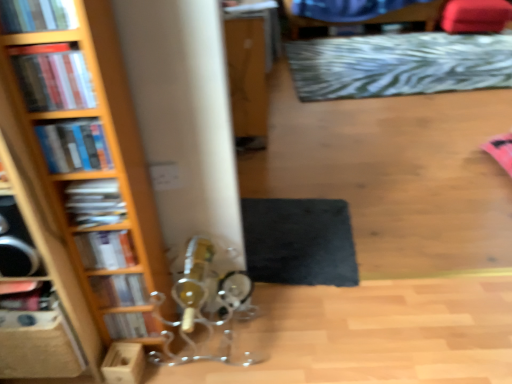
What is the approximate width of matte black book at left, arranged as the 4th book when viewed from the front?

2.40 inches.

Describe the element at coordinates (74, 145) in the screenshot. Image resolution: width=512 pixels, height=384 pixels. I see `hardcover books at left, positioned as the 3th book in top-to-bottom order` at that location.

Measure the distance between wooden bookcase at left and camera.

33.07 inches.

This screenshot has width=512, height=384. Find the location of `matte black book at left, placed as the fourth book when sorted from bottom to top`. matte black book at left, placed as the fourth book when sorted from bottom to top is located at coordinates (94, 203).

From a real-world perspective, is black matte speaker at left over wooden bookcase at left?

Yes, from a real-world perspective, black matte speaker at left is above wooden bookcase at left.

Does point (11, 236) appear closer or farther from the camera than point (112, 213)?

Clearly, point (11, 236) is closer to the camera than point (112, 213).

Considering the sizes of objects black matte speaker at left and wooden bookcase at left in the image provided, who is thinner, black matte speaker at left or wooden bookcase at left?

Thinner between the two is black matte speaker at left.

Considering the sizes of objects blue fabric swivel chair at upper center and hardcover book at upper left, marked as the first book in a front-to-back arrangement, in the image provided, who is smaller, blue fabric swivel chair at upper center or hardcover book at upper left, marked as the first book in a front-to-back arrangement,?

Smaller between the two is hardcover book at upper left, marked as the first book in a front-to-back arrangement.

How different are the orientations of blue fabric swivel chair at upper center and hardcover book at upper left, which is counted as the first book, starting from the top, in degrees?

blue fabric swivel chair at upper center and hardcover book at upper left, which is counted as the first book, starting from the top, are facing 1.14 degrees away from each other.

Does blue fabric swivel chair at upper center have a lesser width compared to hardcover book at upper left, marked as the 7th book in a back-to-front arrangement?

No.

Is wooden bookcase at left oriented away from black felt mat at lower center, which is counted as the 2th mat, starting from the right?

No, wooden bookcase at left's orientation is not away from black felt mat at lower center, which is counted as the 2th mat, starting from the right.

Is wooden bookcase at left to the right of black felt mat at lower center, positioned as the second mat in top-to-bottom order, from the viewer's perspective?

In fact, wooden bookcase at left is to the left of black felt mat at lower center, positioned as the second mat in top-to-bottom order.

Is point (75, 91) farther from viewer compared to point (291, 225)?

No.

Can you confirm if wooden bookcase at left is shorter than black felt mat at lower center, positioned as the second mat in top-to-bottom order?

In fact, wooden bookcase at left may be taller than black felt mat at lower center, positioned as the second mat in top-to-bottom order.

From the image's perspective, is hardcover book at upper left, which is counted as the first book, starting from the top, above or below matte plastic books at left, the 2th book from the front?

hardcover book at upper left, which is counted as the first book, starting from the top, is above matte plastic books at left, the 2th book from the front.

Does point (61, 24) come in front of point (19, 47)?

Yes, it is.

How many degrees apart are the facing directions of hardcover book at upper left, marked as the 7th book in a back-to-front arrangement, and matte plastic books at left, the 6th book from the bottom?

The angular difference between hardcover book at upper left, marked as the 7th book in a back-to-front arrangement, and matte plastic books at left, the 6th book from the bottom, is 0.549 degrees.

Is hardcover book at upper left, marked as the 7th book in a back-to-front arrangement, further to camera compared to matte plastic books at left, arranged as the sixth book when viewed from the back?

No, it is not.

Considering the sizes of objects blue fabric swivel chair at upper center and hardcover book at left, which appears as the third book when ordered from the bottom, in the image provided, who is thinner, blue fabric swivel chair at upper center or hardcover book at left, which appears as the third book when ordered from the bottom,?

hardcover book at left, which appears as the third book when ordered from the bottom, is thinner.

Which is farther from the camera, (433, 6) or (93, 268)?

The point (433, 6) is more distant.

How many degrees apart are the facing directions of blue fabric swivel chair at upper center and hardcover book at left, which ranks as the third book in back-to-front order?

They differ by 2.27 degrees in their facing directions.

How far apart are blue fabric swivel chair at upper center and hardcover book at left, which ranks as the third book in back-to-front order?

They are 12.64 feet apart.

Considering the positions of objects velvet red bean bag chair at upper right and black felt mat at lower center, placed as the first mat when sorted from left to right, in the image provided, who is in front, velvet red bean bag chair at upper right or black felt mat at lower center, placed as the first mat when sorted from left to right,?

black felt mat at lower center, placed as the first mat when sorted from left to right, is in front.

From the image's perspective, is velvet red bean bag chair at upper right located beneath black felt mat at lower center, positioned as the second mat in top-to-bottom order?

No.

From a real-world perspective, who is located higher, velvet red bean bag chair at upper right or black felt mat at lower center, which is counted as the 2th mat, starting from the right?

velvet red bean bag chair at upper right is physically above.

Is velvet red bean bag chair at upper right with black felt mat at lower center, which is the 2th mat from back to front?

No, velvet red bean bag chair at upper right is not beside black felt mat at lower center, which is the 2th mat from back to front.

From the image's perspective, which object appears higher, hardcover book at lower left, which is the 1th book from back to front, or velvet red bean bag chair at upper right?

velvet red bean bag chair at upper right appears higher in the image.

Does hardcover book at lower left, which appears as the first book when ordered from the bottom, have a smaller size compared to velvet red bean bag chair at upper right?

Indeed, hardcover book at lower left, which appears as the first book when ordered from the bottom, has a smaller size compared to velvet red bean bag chair at upper right.

Can you confirm if hardcover book at lower left, arranged as the 7th book when viewed from the front, is positioned to the left of velvet red bean bag chair at upper right?

Correct, you'll find hardcover book at lower left, arranged as the 7th book when viewed from the front, to the left of velvet red bean bag chair at upper right.

Could you tell me if hardcover book at lower left, which is the 1th book from back to front, is turned towards velvet red bean bag chair at upper right?

No.

This screenshot has height=384, width=512. Find the location of `speaker above the wooden bookcase at left (from a real-world perspective)`. speaker above the wooden bookcase at left (from a real-world perspective) is located at coordinates (16, 243).

In the image, there is a hardcover book at upper left, marked as the first book in a front-to-back arrangement. Where is `swivel chair above it (from the image's perspective)`? This screenshot has height=384, width=512. swivel chair above it (from the image's perspective) is located at coordinates (373, 18).

Looking at the image, which one is located further to wooden bookcase at left, hardcover book at left, which ranks as the third book in back-to-front order, or wooden box at lower left?

wooden box at lower left is positioned further to the anchor wooden bookcase at left.

Estimate the real-world distances between objects in this image. Which object is further from zebra-patterned rug at upper center, positioned as the first mat in top-to-bottom order, wooden bookcase at left or hardcover book at lower left, arranged as the 7th book when viewed from the front?

hardcover book at lower left, arranged as the 7th book when viewed from the front.

Based on their spatial positions, is hardcover book at lower left, which appears as the 7th book when viewed from the top, or hardcover book at upper left, which is the 7th book in bottom-to-top order, closer to black felt mat at lower center, positioned as the first mat in bottom-to-top order?

Among the two, hardcover book at lower left, which appears as the 7th book when viewed from the top, is located nearer to black felt mat at lower center, positioned as the first mat in bottom-to-top order.

Estimate the real-world distances between objects in this image. Which object is further from black felt mat at lower center, positioned as the first mat in bottom-to-top order, hardcover book at upper left, marked as the 7th book in a back-to-front arrangement, or matte black book at left, which is the 4th book from top to bottom?

hardcover book at upper left, marked as the 7th book in a back-to-front arrangement.

Looking at the image, which one is located closer to hardcover book at left, which appears as the second book when viewed from the back, hardcover book at lower left, which appears as the 7th book when viewed from the top, or matte black book at left, arranged as the 4th book when viewed from the front?

hardcover book at lower left, which appears as the 7th book when viewed from the top, lies closer to hardcover book at left, which appears as the second book when viewed from the back, than the other object.

Based on their spatial positions, is hardcover books at left, the third book from the front, or matte black book at left, placed as the fourth book when sorted from bottom to top, further from hardcover book at left, which ranks as the third book in back-to-front order?

hardcover books at left, the third book from the front.

When comparing their distances from wooden box at lower left, does hardcover book at left, acting as the 6th book starting from the top, or hardcover book at lower left, which is the 1th book from back to front, seem further?

Among the two, hardcover book at left, acting as the 6th book starting from the top, is located further to wooden box at lower left.

Which object lies further to the anchor point matte black book at left, acting as the 4th book starting from the back, matte plastic books at left, which appears as the 2th book when viewed from the top, or hardcover book at left, which appears as the fifth book when viewed from the front?

matte plastic books at left, which appears as the 2th book when viewed from the top, is further to matte black book at left, acting as the 4th book starting from the back.

Locate an element on the screen. The width and height of the screenshot is (512, 384). book between matte black book at left, placed as the fourth book when sorted from bottom to top, and hardcover book at left, the sixth book positioned from the front, vertically is located at coordinates (106, 249).

Where is `cardboard box located between wooden bookcase at left and black felt mat at lower center, which is counted as the 2th mat, starting from the right, in the depth direction`? The image size is (512, 384). cardboard box located between wooden bookcase at left and black felt mat at lower center, which is counted as the 2th mat, starting from the right, in the depth direction is located at coordinates (124, 363).

Identify the location of bean bag chair between hardcover book at left, acting as the 6th book starting from the top, and blue fabric swivel chair at upper center, along the z-axis. This screenshot has height=384, width=512. (476, 16).

Find the location of `book positioned between hardcover book at left, which appears as the second book when viewed from the back, and velvet red bean bag chair at upper right from near to far`. book positioned between hardcover book at left, which appears as the second book when viewed from the back, and velvet red bean bag chair at upper right from near to far is located at coordinates (131, 325).